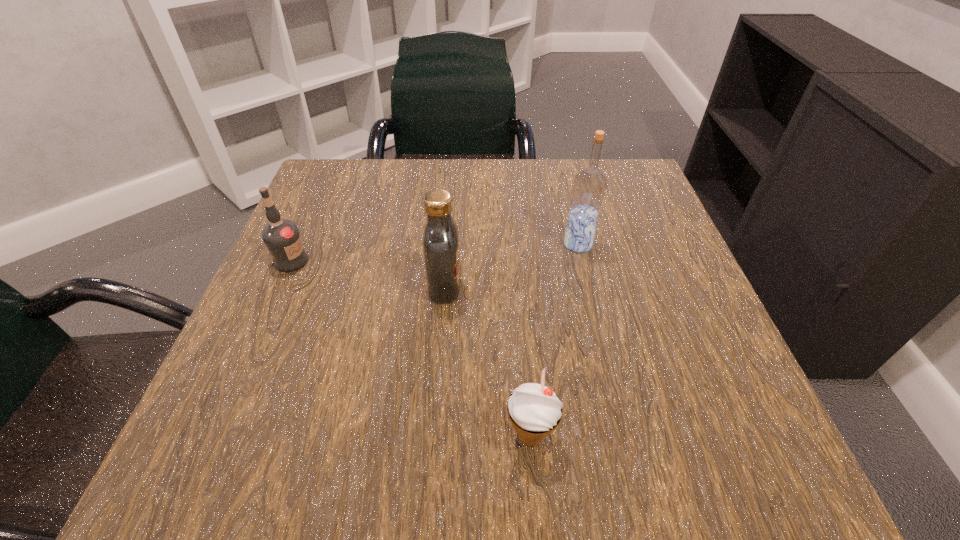
The image size is (960, 540). I want to click on free spot that satisfies the following two spatial constraints: 1. on the front label of the third object from left to right; 2. on the left side of the third tallest object, so click(214, 436).